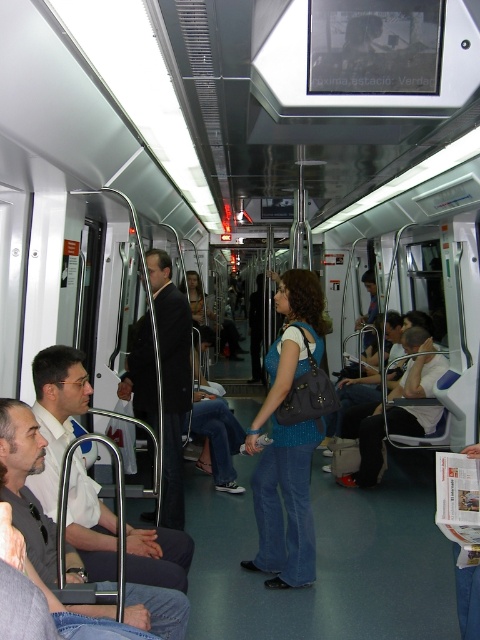
Is the position of white shirt at left less distant than that of black suit coat at center?

Yes, white shirt at left is closer to the viewer.

What are the coordinates of `white shirt at left` in the screenshot? It's located at (57, 412).

Does black suit coat at center have a greater width compared to denim jeans at center?

No, black suit coat at center is not wider than denim jeans at center.

Does black suit coat at center have a lesser height compared to denim jeans at center?

No, black suit coat at center is not shorter than denim jeans at center.

Between point (145, 408) and point (355, 472), which one is positioned in front?

Point (145, 408)

The width and height of the screenshot is (480, 640). I want to click on black suit coat at center, so click(171, 380).

Which is behind, point (73, 493) or point (432, 396)?

The point (432, 396) is behind.

From the picture: Who is positioned more to the left, white shirt at left or denim jeans at center?

white shirt at left is more to the left.

The image size is (480, 640). I want to click on white shirt at left, so click(57, 412).

Identify the location of white shirt at left. The width and height of the screenshot is (480, 640). (57, 412).